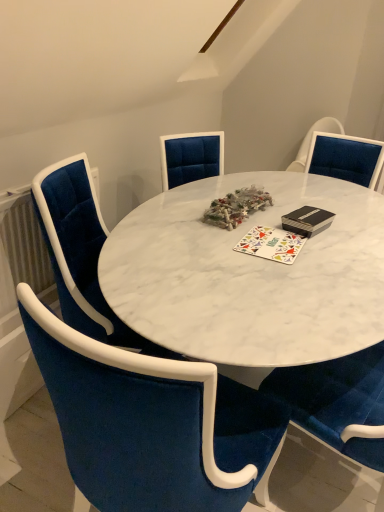
The height and width of the screenshot is (512, 384). Describe the element at coordinates (81, 253) in the screenshot. I see `velvet blue chair at left, the 1th chair in the back-to-front sequence` at that location.

Locate an element on the screen. velvet blue chair at center, the 2th chair positioned from the back is located at coordinates (147, 423).

The width and height of the screenshot is (384, 512). I want to click on velvet blue chair at left, the 2th chair when ordered from front to back, so click(x=81, y=253).

Find the location of a particular element. This screenshot has height=512, width=384. the 2nd chair in front when counting from the multicolored fabric mat at center is located at coordinates (147, 423).

From the image's perspective, which one is positioned higher, velvet blue chair at center, the 2th chair positioned from the back, or multicolored fabric mat at center?

multicolored fabric mat at center appears higher in the image.

Is velvet blue chair at center, positioned as the first chair in front-to-back order, touching multicolored fabric mat at center?

No.

How different are the orientations of velvet blue chair at center, the 2th chair positioned from the back, and multicolored fabric mat at center in degrees?

They differ by 1.41 degrees in their facing directions.

Who is smaller, multicolored fabric mat at center or velvet blue chair at center, the 2th chair positioned from the back?

multicolored fabric mat at center is smaller.

From a real-world perspective, between multicolored fabric mat at center and velvet blue chair at center, the 2th chair positioned from the back, who is vertically higher?

multicolored fabric mat at center.

Based on the photo, is multicolored fabric mat at center not within velvet blue chair at center, the 2th chair positioned from the back?

multicolored fabric mat at center is positioned outside velvet blue chair at center, the 2th chair positioned from the back.

Would you consider multicolored fabric mat at center to be distant from velvet blue chair at left, the 2th chair when ordered from front to back?

They are positioned close to each other.

Based on the photo, how distant is multicolored fabric mat at center from velvet blue chair at left, the 2th chair when ordered from front to back?

A distance of 22.23 inches exists between multicolored fabric mat at center and velvet blue chair at left, the 2th chair when ordered from front to back.

Which is closer to the camera, [272,243] or [112,334]?

Positioned in front is point [112,334].

How many degrees apart are the facing directions of multicolored fabric mat at center and velvet blue chair at left, the 1th chair in the back-to-front sequence?

There is a 75-degree angle between the facing directions of multicolored fabric mat at center and velvet blue chair at left, the 1th chair in the back-to-front sequence.

Would you consider velvet blue chair at left, the 1th chair in the back-to-front sequence, to be distant from multicolored fabric mat at center?

No, there isn't a large distance between velvet blue chair at left, the 1th chair in the back-to-front sequence, and multicolored fabric mat at center.

You are a GUI agent. You are given a task and a screenshot of the screen. Output one action in this format:
    pyautogui.click(x=<x>, y=<y>)
    Task: Click on the 1st chair below the multicolored fabric mat at center (from the image's perspective)
    The width and height of the screenshot is (384, 512).
    Given the screenshot: What is the action you would take?
    pyautogui.click(x=81, y=253)

Consider the image. From a real-world perspective, relative to multicolored fabric mat at center, is velvet blue chair at left, the 1th chair in the back-to-front sequence, vertically above or below?

Clearly, from a real-world perspective, velvet blue chair at left, the 1th chair in the back-to-front sequence, is below multicolored fabric mat at center.

Which object is positioned more to the right, velvet blue chair at left, the 1th chair in the back-to-front sequence, or multicolored fabric mat at center?

multicolored fabric mat at center.

Is point (138, 341) closer or farther from the camera than point (74, 384)?

Clearly, point (138, 341) is more distant from the camera than point (74, 384).

Which of these two, velvet blue chair at left, the 2th chair when ordered from front to back, or velvet blue chair at center, positioned as the first chair in front-to-back order, stands shorter?

velvet blue chair at left, the 2th chair when ordered from front to back, is shorter.

Can you confirm if velvet blue chair at left, the 2th chair when ordered from front to back, is thinner than velvet blue chair at center, the 2th chair positioned from the back?

No.

You are a GUI agent. You are given a task and a screenshot of the screen. Output one action in this format:
    pyautogui.click(x=<x>, y=<y>)
    Task: Click on the chair on the right of velvet blue chair at left, the 1th chair in the back-to-front sequence
    The image size is (384, 512).
    Given the screenshot: What is the action you would take?
    pyautogui.click(x=147, y=423)

Measure the distance between velvet blue chair at center, positioned as the first chair in front-to-back order, and velvet blue chair at left, the 2th chair when ordered from front to back.

velvet blue chair at center, positioned as the first chair in front-to-back order, is 16.74 inches from velvet blue chair at left, the 2th chair when ordered from front to back.

Could velvet blue chair at left, the 1th chair in the back-to-front sequence, be considered to be inside velvet blue chair at center, positioned as the first chair in front-to-back order?

Actually, velvet blue chair at left, the 1th chair in the back-to-front sequence, is outside velvet blue chair at center, positioned as the first chair in front-to-back order.

Is point (145, 364) positioned in front of point (69, 168)?

Yes.

Find the location of a particular element. chair in front of the velvet blue chair at left, the 1th chair in the back-to-front sequence is located at coordinates (147, 423).

Find the location of a particular element. The width and height of the screenshot is (384, 512). card game on the right of velvet blue chair at center, the 2th chair positioned from the back is located at coordinates (271, 244).

At what (x,y) coordinates should I click in order to perform the action: click on chair that is the 2nd object located below the multicolored fabric mat at center (from the image's perspective). Please return your answer as a coordinate pair (x, y). This screenshot has height=512, width=384. Looking at the image, I should click on (147, 423).

Based on their spatial positions, is velvet blue chair at left, the 2th chair when ordered from front to back, or multicolored fabric mat at center closer to velvet blue chair at center, the 2th chair positioned from the back?

velvet blue chair at left, the 2th chair when ordered from front to back.

Which object lies further to the anchor point velvet blue chair at left, the 2th chair when ordered from front to back, multicolored fabric mat at center or velvet blue chair at center, positioned as the first chair in front-to-back order?

multicolored fabric mat at center is further to velvet blue chair at left, the 2th chair when ordered from front to back.

Considering their positions, is velvet blue chair at left, the 1th chair in the back-to-front sequence, positioned closer to multicolored fabric mat at center than velvet blue chair at center, positioned as the first chair in front-to-back order?

velvet blue chair at left, the 1th chair in the back-to-front sequence, is positioned closer to the anchor multicolored fabric mat at center.

Considering their positions, is multicolored fabric mat at center positioned further to velvet blue chair at center, the 2th chair positioned from the back, than velvet blue chair at left, the 2th chair when ordered from front to back?

Based on the image, multicolored fabric mat at center appears to be further to velvet blue chair at center, the 2th chair positioned from the back.

Which object lies nearer to the anchor point velvet blue chair at left, the 2th chair when ordered from front to back, velvet blue chair at center, positioned as the first chair in front-to-back order, or multicolored fabric mat at center?

velvet blue chair at center, positioned as the first chair in front-to-back order, lies closer to velvet blue chair at left, the 2th chair when ordered from front to back, than the other object.

Looking at the image, which one is located closer to multicolored fabric mat at center, velvet blue chair at center, the 2th chair positioned from the back, or velvet blue chair at left, the 2th chair when ordered from front to back?

velvet blue chair at left, the 2th chair when ordered from front to back, lies closer to multicolored fabric mat at center than the other object.

Where is `chair between velvet blue chair at center, the 2th chair positioned from the back, and multicolored fabric mat at center from front to back`? chair between velvet blue chair at center, the 2th chair positioned from the back, and multicolored fabric mat at center from front to back is located at coordinates (81, 253).